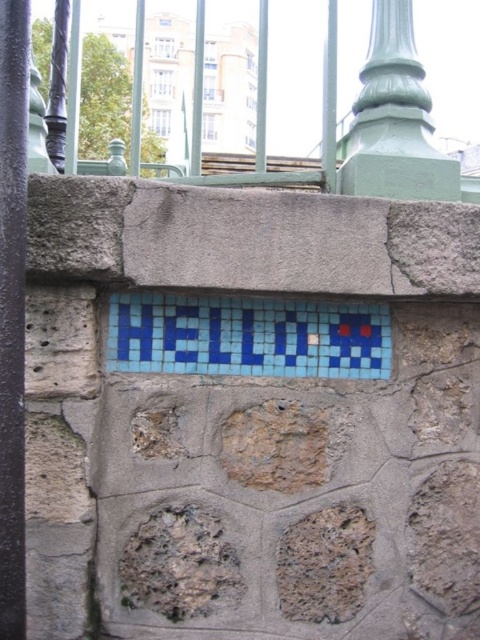
Question: Which of the following is the closest to the observer?

Choices:
 (A) green painted metal pillar at upper center
 (B) blue mosaic tiles at center
 (C) green painted metal fence at upper center
 (D) smooth purple pole at left

Answer: (D)

Question: Which of the following is the closest to the observer?

Choices:
 (A) smooth purple pole at left
 (B) green painted metal pillar at upper center
 (C) green painted metal fence at upper center
 (D) blue mosaic tiles at center

Answer: (A)

Question: Estimate the real-world distances between objects in this image. Which object is closer to the green painted metal fence at upper center?

Choices:
 (A) blue mosaic tiles at center
 (B) smooth purple pole at left

Answer: (A)

Question: Can you confirm if blue mosaic tiles at center is thinner than smooth purple pole at left?

Choices:
 (A) yes
 (B) no

Answer: (B)

Question: Does smooth purple pole at left appear over green painted metal pillar at upper center?

Choices:
 (A) no
 (B) yes

Answer: (A)

Question: Can you confirm if blue mosaic tiles at center is smaller than smooth purple pole at left?

Choices:
 (A) no
 (B) yes

Answer: (A)